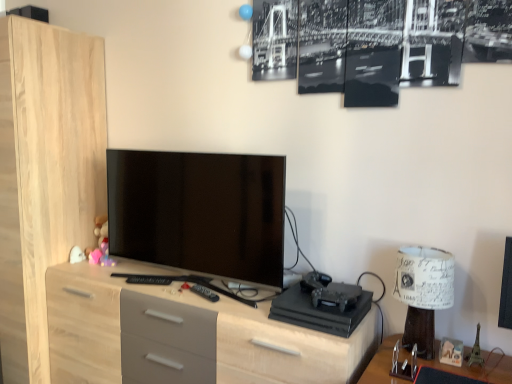
Measure the distance between point [426,305] and camera.

The depth of point [426,305] is 1.43 meters.

Where is `matte black tv at center`? This screenshot has height=384, width=512. matte black tv at center is located at coordinates (199, 212).

Considering the positions of objects matte black tv at center and white paper lampshade at right in the image provided, who is in front, matte black tv at center or white paper lampshade at right?

white paper lampshade at right is more forward.

From the image's perspective, is matte black tv at center beneath white paper lampshade at right?

No, from the image's perspective, matte black tv at center is not below white paper lampshade at right.

From a real-world perspective, which is physically below, matte black tv at center or white paper lampshade at right?

From a 3D spatial view, white paper lampshade at right is below.

Which object is thinner, white paper lampshade at right or light wood/grey drawers at center?

white paper lampshade at right.

Consider the image. From the image's perspective, which one is positioned lower, white paper lampshade at right or light wood/grey drawers at center?

From the image's view, light wood/grey drawers at center is below.

From a real-world perspective, between white paper lampshade at right and light wood/grey drawers at center, who is vertically higher?

white paper lampshade at right, from a real-world perspective.

What's the angular difference between white paper lampshade at right and light wood/grey drawers at center's facing directions?

There is a 1.13-degree angle between the facing directions of white paper lampshade at right and light wood/grey drawers at center.

Is the surface of white paper lampshade at right in direct contact with matte black tv at center?

white paper lampshade at right and matte black tv at center are clearly separated.

From the image's perspective, is white paper lampshade at right beneath matte black tv at center?

Yes, from the image's perspective, white paper lampshade at right is beneath matte black tv at center.

From a real-world perspective, is light wood/grey drawers at center below matte black tv at center?

Yes, from a real-world perspective, light wood/grey drawers at center is under matte black tv at center.

Which is more distant, (198, 312) or (254, 219)?

The point (254, 219) is more distant.

Based on the photo, is light wood/grey drawers at center positioned beyond the bounds of matte black tv at center?

Yes.

Is light wood/grey drawers at center not near white paper lampshade at right?

That's not correct — light wood/grey drawers at center is a little close to white paper lampshade at right.

How many degrees apart are the facing directions of light wood/grey drawers at center and white paper lampshade at right?

There is a 1.13-degree angle between the facing directions of light wood/grey drawers at center and white paper lampshade at right.

Is light wood/grey drawers at center oriented away from white paper lampshade at right?

light wood/grey drawers at center does not have its back to white paper lampshade at right.

Is light wood/grey drawers at center to the left of white paper lampshade at right from the viewer's perspective?

Yes, light wood/grey drawers at center is to the left of white paper lampshade at right.

How far apart are matte black tv at center and light wood/grey drawers at center?

→ They are 12.53 inches apart.

In the scene shown: From the image's perspective, which is below, matte black tv at center or light wood/grey drawers at center?

light wood/grey drawers at center is shown below in the image.

Considering the relative sizes of matte black tv at center and light wood/grey drawers at center in the image provided, is matte black tv at center smaller than light wood/grey drawers at center?

Yes, matte black tv at center is smaller than light wood/grey drawers at center.

Is matte black tv at center surrounding light wood/grey drawers at center?

No.

The image size is (512, 384). I want to click on television that appears behind the white paper lampshade at right, so coord(199,212).

You are a GUI agent. You are given a task and a screenshot of the screen. Output one action in this format:
    pyautogui.click(x=<x>, y=<y>)
    Task: Click on the chest of drawers in front of the white paper lampshade at right
    
    Given the screenshot: What is the action you would take?
    183,334

Estimate the real-world distances between objects in this image. Which object is further from white paper lampshade at right, matte black tv at center or light wood/grey drawers at center?

matte black tv at center lies further to white paper lampshade at right than the other object.

Estimate the real-world distances between objects in this image. Which object is closer to light wood/grey drawers at center, white paper lampshade at right or matte black tv at center?

matte black tv at center lies closer to light wood/grey drawers at center than the other object.

Considering their positions, is light wood/grey drawers at center positioned further to matte black tv at center than white paper lampshade at right?

white paper lampshade at right.

Considering their positions, is white paper lampshade at right positioned closer to matte black tv at center than light wood/grey drawers at center?

light wood/grey drawers at center is closer to matte black tv at center.

From the image, which object appears to be farther from light wood/grey drawers at center, matte black tv at center or white paper lampshade at right?

Among the two, white paper lampshade at right is located further to light wood/grey drawers at center.

Based on their spatial positions, is light wood/grey drawers at center or matte black tv at center closer to white paper lampshade at right?

Based on the image, light wood/grey drawers at center appears to be nearer to white paper lampshade at right.

Identify the location of chest of drawers between matte black tv at center and white paper lampshade at right in the horizontal direction. (183, 334).